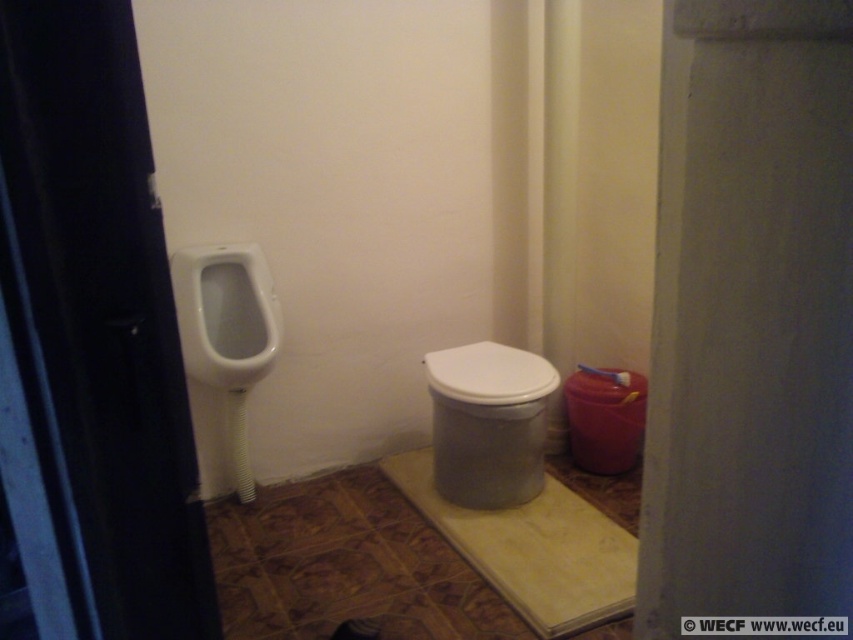
Does white glossy toilet at center have a greater width compared to white glossy urinal at left?

Yes.

Is point (440, 465) farther from viewer compared to point (215, 273)?

Yes, point (440, 465) is farther from viewer.

The height and width of the screenshot is (640, 853). Find the location of `white glossy toilet at center`. white glossy toilet at center is located at coordinates (488, 422).

Where is `white glossy toilet at center`? Image resolution: width=853 pixels, height=640 pixels. white glossy toilet at center is located at coordinates (488, 422).